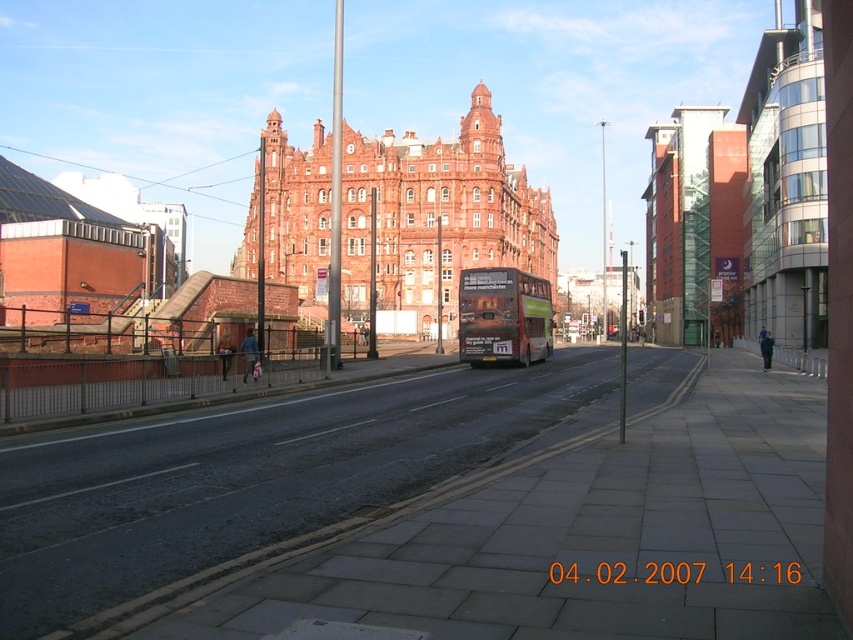
Is red brick building at center behind green matte double-decker bus at center?

Yes, it is.

Which is behind, point (540, 220) or point (531, 356)?

Point (540, 220)

Where is `red brick building at center`? red brick building at center is located at coordinates (436, 216).